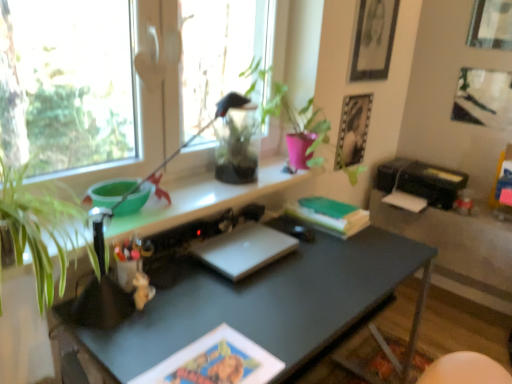
Describe the element at coordinates (260, 302) in the screenshot. I see `matte black desk at center` at that location.

Describe the element at coordinates (236, 146) in the screenshot. I see `transparent glass vase at upper center` at that location.

This screenshot has width=512, height=384. What do you see at coordinates (244, 249) in the screenshot?
I see `sleek silver laptop at center` at bounding box center [244, 249].

Find the location of a particular element. This screenshot has height=384, width=512. sleek silver laptop at center is located at coordinates (244, 249).

Measure the distance between wooden picture frame at upper right, placed as the fourth picture frame when sorted from left to right, and camera.

wooden picture frame at upper right, placed as the fourth picture frame when sorted from left to right, and camera are 2.21 meters apart from each other.

At what (x,y) coordinates should I click in order to perform the action: click on matte black desk at center. Please return your answer as a coordinate pair (x, y). Looking at the image, I should click on (260, 302).

Could you tell me if transparent glass vase at upper center is facing wooden picture frame at upper right, placed as the fourth picture frame when sorted from left to right?

No, transparent glass vase at upper center is not turned towards wooden picture frame at upper right, placed as the fourth picture frame when sorted from left to right.

How many degrees apart are the facing directions of transparent glass vase at upper center and wooden picture frame at upper right, the first picture frame in the right-to-left sequence?

There is a 91.8-degree angle between the facing directions of transparent glass vase at upper center and wooden picture frame at upper right, the first picture frame in the right-to-left sequence.

From the image's perspective, is transparent glass vase at upper center located above wooden picture frame at upper right, the first picture frame in the right-to-left sequence?

No, from the image's perspective, transparent glass vase at upper center is not above wooden picture frame at upper right, the first picture frame in the right-to-left sequence.

Visually, is transparent glass vase at upper center positioned to the left or to the right of wooden picture frame at upper right, placed as the fourth picture frame when sorted from left to right?

Based on their positions, transparent glass vase at upper center is located to the left of wooden picture frame at upper right, placed as the fourth picture frame when sorted from left to right.

This screenshot has width=512, height=384. I want to click on plant above the matte black desk at center (from a real-world perspective), so click(297, 116).

Can you confirm if green matte plant at upper center is positioned to the right of matte black desk at center?

Indeed, green matte plant at upper center is positioned on the right side of matte black desk at center.

Is point (287, 91) in front of point (315, 290)?

No, (287, 91) is further to viewer.

In the scene shown: From the image's perspective, is sleek silver laptop at center beneath black plastic table at lower right?

No.

Which of these two, sleek silver laptop at center or black plastic table at lower right, is thinner?

sleek silver laptop at center.

Relative to black plastic table at lower right, is sleek silver laptop at center in front or behind?

sleek silver laptop at center is positioned closer to the viewer than black plastic table at lower right.

Which of these two, sleek silver laptop at center or transparent glass window at upper left, is wider?

Wider between the two is transparent glass window at upper left.

Is sleek silver laptop at center located outside transparent glass window at upper left?

Yes, sleek silver laptop at center is outside of transparent glass window at upper left.

Considering the points (218, 263) and (148, 77), which point is in front, point (218, 263) or point (148, 77)?

The point (218, 263) is more forward.

Does sleek silver laptop at center touch transparent glass window at upper left?

sleek silver laptop at center is not next to transparent glass window at upper left, and they're not touching.

Is transparent glass window at upper left not near metallic silver photo frame at upper right, placed as the 4th picture frame when sorted from right to left?

Yes, transparent glass window at upper left is far from metallic silver photo frame at upper right, placed as the 4th picture frame when sorted from right to left.

From the transparent glass window at upper left, count 1st picture frame to the right and point to it. Please provide its 2D coordinates.

[(353, 133)]

Is transparent glass window at upper left in front of metallic silver photo frame at upper right, placed as the 4th picture frame when sorted from right to left?

Yes, it is in front of metallic silver photo frame at upper right, placed as the 4th picture frame when sorted from right to left.

From the image's perspective, between transparent glass window at upper left and matte black desk at center, which one is located above?

transparent glass window at upper left appears higher in the image.

Between transparent glass window at upper left and matte black desk at center, which one has larger width?

matte black desk at center is wider.

Is transparent glass window at upper left facing away from matte black desk at center?

That's not correct — transparent glass window at upper left is not looking away from matte black desk at center.

The width and height of the screenshot is (512, 384). Find the location of `window above the matte black desk at center (from a real-world perspective)`. window above the matte black desk at center (from a real-world perspective) is located at coordinates (114, 80).

From the image's perspective, does matte black desk at center appear lower than transparent glass vase at upper center?

Yes.

Consider the image. Could you tell me if matte black desk at center is turned towards transparent glass vase at upper center?

No, matte black desk at center is not oriented towards transparent glass vase at upper center.

This screenshot has height=384, width=512. Find the location of `glass vase that appears behind the matte black desk at center`. glass vase that appears behind the matte black desk at center is located at coordinates (236, 146).

How far apart are matte black desk at center and transparent glass vase at upper center?

matte black desk at center and transparent glass vase at upper center are 53.31 centimeters apart from each other.

There is a transparent glass vase at upper center. What are the coordinates of `the 4th picture frame above it (from the image's perspective)` in the screenshot? It's located at (490, 25).

Where is `plant above the matte black desk at center (from a real-world perspective)`? The width and height of the screenshot is (512, 384). plant above the matte black desk at center (from a real-world perspective) is located at coordinates (297, 116).

Estimate the real-world distances between objects in this image. Which object is closer to matte black picture frame at upper right, which ranks as the third picture frame in right-to-left order, black plastic table at lower right or transparent glass vase at upper center?

transparent glass vase at upper center is closer to matte black picture frame at upper right, which ranks as the third picture frame in right-to-left order.

From the image, which object appears to be farther from black plastic printer at right, transparent glass vase at upper center or sleek silver laptop at center?

sleek silver laptop at center.

Estimate the real-world distances between objects in this image. Which object is closer to metallic silver photo frame at upper right, positioned as the first picture frame in left-to-right order, sleek silver laptop at center or matte black picture frame at upper right, acting as the 2th picture frame starting from the left?

Based on the image, matte black picture frame at upper right, acting as the 2th picture frame starting from the left, appears to be nearer to metallic silver photo frame at upper right, positioned as the first picture frame in left-to-right order.

Looking at the image, which one is located closer to black plastic printer at right, sleek silver laptop at center or wooden picture frame at upper right, placed as the fourth picture frame when sorted from left to right?

The object closer to black plastic printer at right is wooden picture frame at upper right, placed as the fourth picture frame when sorted from left to right.

Looking at the image, which one is located further to transparent glass window at upper left, metallic silver picture frame at upper right, arranged as the 2th picture frame when viewed from the right, or transparent glass vase at upper center?

Based on the image, metallic silver picture frame at upper right, arranged as the 2th picture frame when viewed from the right, appears to be further to transparent glass window at upper left.

From the image, which object appears to be nearer to black plastic printer at right, sleek silver laptop at center or metallic silver picture frame at upper right, arranged as the 2th picture frame when viewed from the right?

Among the two, metallic silver picture frame at upper right, arranged as the 2th picture frame when viewed from the right, is located nearer to black plastic printer at right.

From the image, which object appears to be farther from metallic silver picture frame at upper right, the third picture frame when ordered from left to right, sleek silver laptop at center or black plastic printer at right?

sleek silver laptop at center.

Estimate the real-world distances between objects in this image. Which object is closer to transparent glass window at upper left, sleek silver laptop at center or green matte plant at upper center?

green matte plant at upper center.

Identify the location of laptop situated between transparent glass vase at upper center and wooden picture frame at upper right, the first picture frame in the right-to-left sequence, from left to right. Image resolution: width=512 pixels, height=384 pixels. (244, 249).

Find the location of a particular element. This screenshot has width=512, height=384. printer between wooden picture frame at upper right, placed as the fourth picture frame when sorted from left to right, and matte black desk at center vertically is located at coordinates (421, 181).

Where is `paperback book between transparent glass window at upper left and black plastic printer at right along the z-axis`? Image resolution: width=512 pixels, height=384 pixels. paperback book between transparent glass window at upper left and black plastic printer at right along the z-axis is located at coordinates (329, 215).

Find the location of a particular element. The height and width of the screenshot is (384, 512). printer between wooden picture frame at upper right, placed as the fourth picture frame when sorted from left to right, and black plastic table at lower right in the up-down direction is located at coordinates (421, 181).